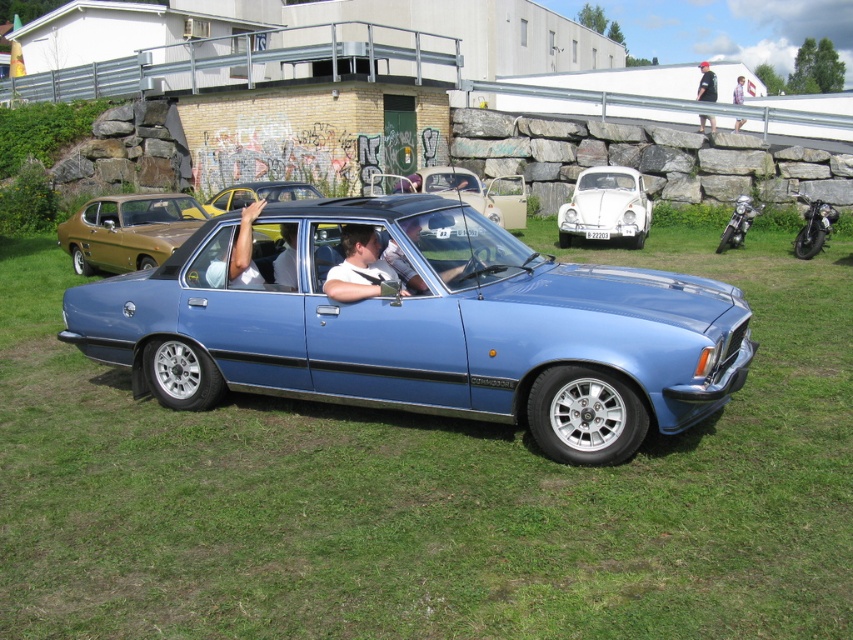
You are a photographer trying to capture a clear photo of the black plastic license plate at center while ensuring the matte black car at center is also in the frame. Will the license plate be fully visible in the photo if you focus on the car?

The matte black car at center is taller than the black plastic license plate at center, so focusing on the car may cause the license plate to be partially obscured or out of focus. Adjust your angle or zoom to ensure both are clearly visible.